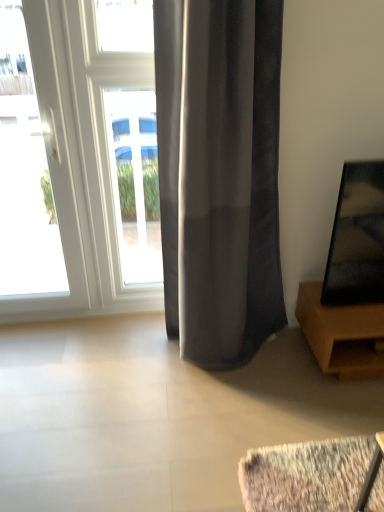
Find the location of a particular element. empty space that is in between satin gray curtain at center and white glossy door at left is located at coordinates (109, 339).